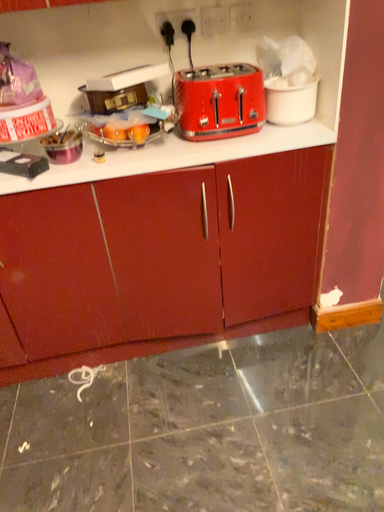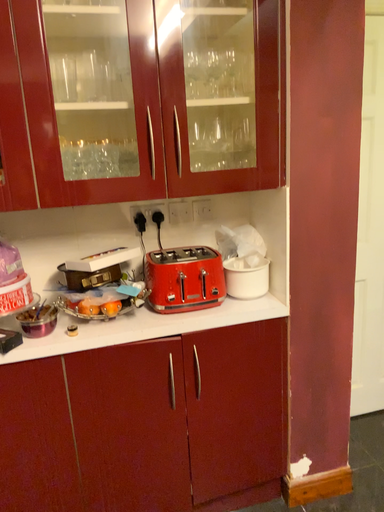
Question: Which way did the camera rotate in the video?

Choices:
 (A) rotated downward
 (B) rotated upward

Answer: (B)